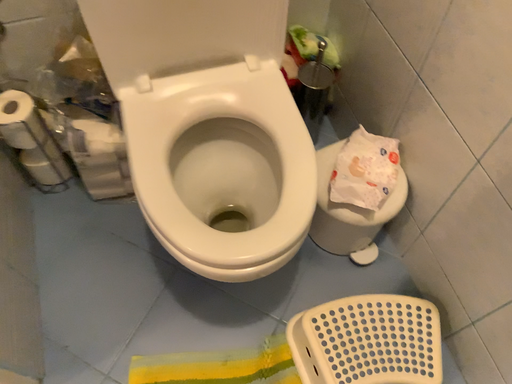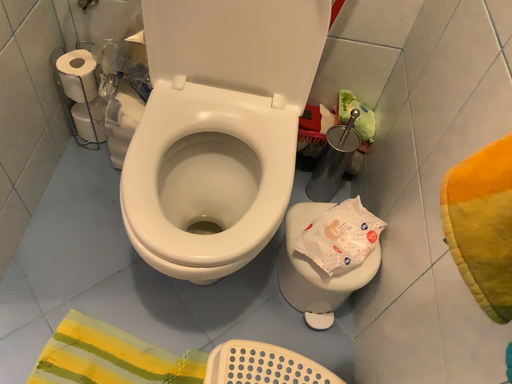
Question: Which way did the camera rotate in the video?

Choices:
 (A) rotated right
 (B) rotated left

Answer: (B)